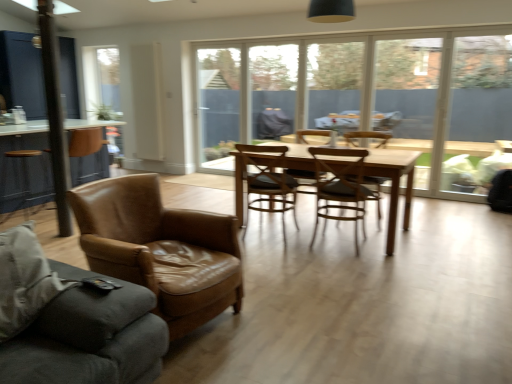
The height and width of the screenshot is (384, 512). Identify the location of brown leather armchair at left, the 1th chair in the front-to-back sequence. (161, 248).

The image size is (512, 384). I want to click on wooden chair at center, placed as the 1th chair when sorted from back to front, so click(315, 135).

The width and height of the screenshot is (512, 384). What do you see at coordinates (366, 137) in the screenshot?
I see `wooden chair at center, which ranks as the 4th chair in front-to-back order` at bounding box center [366, 137].

Describe the element at coordinates (273, 89) in the screenshot. This screenshot has width=512, height=384. I see `transparent glass window at center, which is counted as the second window, starting from the right` at that location.

Locate an element on the screen. light brown wooden table at center is located at coordinates (394, 184).

From the image's perspective, count 2nd chairs downward from the white matte radiator at upper center and point to it. Please provide its 2D coordinates.

[(366, 137)]

Can you confirm if white matte radiator at upper center is smaller than wooden chair at center, the 2th chair from the back?

Yes, white matte radiator at upper center is smaller than wooden chair at center, the 2th chair from the back.

Considering their positions, is white matte radiator at upper center located in front of or behind wooden chair at center, which ranks as the 4th chair in front-to-back order?

Visually, white matte radiator at upper center is located behind wooden chair at center, which ranks as the 4th chair in front-to-back order.

From the image's perspective, is white matte radiator at upper center under wooden chair at center, which ranks as the 4th chair in front-to-back order?

No.

Would you say transparent glass table at center, arranged as the second window when viewed from the left, is inside or outside wooden chair at center, which ranks as the 4th chair in front-to-back order?

transparent glass table at center, arranged as the second window when viewed from the left, is spatially situated outside wooden chair at center, which ranks as the 4th chair in front-to-back order.

From a real-world perspective, which object rests below the other?

wooden chair at center, the 2th chair from the back, from a real-world perspective.

Does point (333, 73) come in front of point (346, 134)?

No.

Can you tell me how much transparent glass table at center, arranged as the second window when viewed from the left, and wooden chair at center, which ranks as the 4th chair in front-to-back order, differ in facing direction?

There is a 2.73-degree angle between the facing directions of transparent glass table at center, arranged as the second window when viewed from the left, and wooden chair at center, which ranks as the 4th chair in front-to-back order.

Can you confirm if brown leather chair at center, which is the 3th chair from front to back, is wider than transparent glass table at center, the 1th window positioned from the right?

Correct, the width of brown leather chair at center, which is the 3th chair from front to back, exceeds that of transparent glass table at center, the 1th window positioned from the right.

You are a GUI agent. You are given a task and a screenshot of the screen. Output one action in this format:
    pyautogui.click(x=<x>, y=<y>)
    Task: Click on the 3rd chair positioned below the transparent glass table at center, the 1th window positioned from the right (from the image's perspective)
    This screenshot has height=384, width=512.
    Given the screenshot: What is the action you would take?
    pyautogui.click(x=268, y=178)

Consider the image. Is brown leather chair at center, the 3th chair from the back, at the right side of transparent glass table at center, arranged as the second window when viewed from the left?

In fact, brown leather chair at center, the 3th chair from the back, is to the left of transparent glass table at center, arranged as the second window when viewed from the left.

From a real-world perspective, which object stands above the other?

transparent glass table at center, the 1th window positioned from the right, is physically above.

Which is in front, point (213, 105) or point (17, 371)?

The point (17, 371) is closer to the camera.

Considering the sizes of objects transparent glass door at center and leather couch at left in the image provided, who is wider, transparent glass door at center or leather couch at left?

Wider between the two is leather couch at left.

From the image's perspective, would you say transparent glass door at center is positioned over leather couch at left?

Correct, transparent glass door at center appears higher than leather couch at left in the image.

Locate an element on the screen. window screen that appears above the leather couch at left (from a real-world perspective) is located at coordinates (218, 104).

Is transparent glass window at center, the first window from the left, smaller than transparent glass door at center?

Indeed, transparent glass window at center, the first window from the left, has a smaller size compared to transparent glass door at center.

Is the surface of transparent glass window at center, the first window from the left, in direct contact with transparent glass door at center?

No.

Where is `window screen located underneath the transparent glass window at center, which is counted as the second window, starting from the right (from a real-world perspective)`? window screen located underneath the transparent glass window at center, which is counted as the second window, starting from the right (from a real-world perspective) is located at coordinates (218, 104).

Is transparent glass window at center, the first window from the left, to the left of transparent glass door at center from the viewer's perspective?

No.

Who is shorter, transparent glass door at center or wooden chair at center, the second chair when ordered from front to back?

With less height is wooden chair at center, the second chair when ordered from front to back.

Which is correct: transparent glass door at center is inside wooden chair at center, the fourth chair in the back-to-front sequence, or outside of it?

transparent glass door at center is not enclosed by wooden chair at center, the fourth chair in the back-to-front sequence.

Which object is positioned more to the right, transparent glass door at center or wooden chair at center, the fourth chair in the back-to-front sequence?

wooden chair at center, the fourth chair in the back-to-front sequence, is more to the right.

Is transparent glass door at center touching brown leather armchair at left, the 5th chair viewed from the back?

No, transparent glass door at center is not beside brown leather armchair at left, the 5th chair viewed from the back.

Is transparent glass door at center completely or partially outside of brown leather armchair at left, the 1th chair in the front-to-back sequence?

transparent glass door at center lies outside brown leather armchair at left, the 1th chair in the front-to-back sequence,'s area.

Considering the relative sizes of transparent glass door at center and brown leather armchair at left, the 1th chair in the front-to-back sequence, in the image provided, is transparent glass door at center bigger than brown leather armchair at left, the 1th chair in the front-to-back sequence,?

No, transparent glass door at center is not bigger than brown leather armchair at left, the 1th chair in the front-to-back sequence.

Is transparent glass door at center taller or shorter than brown leather armchair at left, the 5th chair viewed from the back?

Considering their sizes, transparent glass door at center has more height than brown leather armchair at left, the 5th chair viewed from the back.

You are a GUI agent. You are given a task and a screenshot of the screen. Output one action in this format:
    pyautogui.click(x=<x>, y=<y>)
    Task: Click on the 1st chair located beneath the white matte radiator at upper center (from a real-world perspective)
    Image resolution: width=512 pixels, height=384 pixels.
    Given the screenshot: What is the action you would take?
    pyautogui.click(x=366, y=137)

From the image's perspective, count 2nd chairs downward from the transparent glass table at center, the 1th window positioned from the right, and point to it. Please provide its 2D coordinates.

[(366, 137)]

Based on their spatial positions, is brown leather chair at center, the 3th chair from the back, or wooden chair at center, which ranks as the 4th chair in front-to-back order, further from wooden chair at center, which is the 5th chair from front to back?

brown leather chair at center, the 3th chair from the back, lies further to wooden chair at center, which is the 5th chair from front to back, than the other object.

Based on the photo, considering their positions, is wooden chair at center, placed as the 1th chair when sorted from back to front, positioned further to transparent glass door at center than transparent glass table at center, the 1th window positioned from the right?

Among the two, wooden chair at center, placed as the 1th chair when sorted from back to front, is located further to transparent glass door at center.

In the scene shown: From the image, which object appears to be nearer to transparent glass window at center, which is counted as the second window, starting from the right, light brown wooden table at center or leather couch at left?

light brown wooden table at center is positioned closer to the anchor transparent glass window at center, which is counted as the second window, starting from the right.

When comparing their distances from leather couch at left, does brown leather armchair at left, the 5th chair viewed from the back, or transparent glass window at center, which is counted as the second window, starting from the right, seem closer?

brown leather armchair at left, the 5th chair viewed from the back, is closer to leather couch at left.

Considering their positions, is leather couch at left positioned closer to wooden chair at center, which ranks as the 4th chair in front-to-back order, than brown leather table at left?

leather couch at left is closer to wooden chair at center, which ranks as the 4th chair in front-to-back order.

Estimate the real-world distances between objects in this image. Which object is further from transparent glass table at center, arranged as the second window when viewed from the left, transparent glass door at center or wooden chair at center, which ranks as the 4th chair in front-to-back order?

wooden chair at center, which ranks as the 4th chair in front-to-back order.

Looking at the image, which one is located closer to transparent glass door at center, white matte radiator at upper center or transparent glass window at center, which is counted as the second window, starting from the right?

transparent glass window at center, which is counted as the second window, starting from the right.

From the image, which object appears to be nearer to wooden chair at center, which ranks as the 4th chair in front-to-back order, brown leather table at left or transparent glass door at center?

transparent glass door at center.

Locate an element on the screen. The image size is (512, 384). chair positioned between wooden chair at center, which ranks as the 4th chair in front-to-back order, and transparent glass table at center, arranged as the second window when viewed from the left, from near to far is located at coordinates (315, 135).

Where is `kitchen & dining room table between brown leather armchair at left, the 1th chair in the front-to-back sequence, and wooden chair at center, placed as the 1th chair when sorted from back to front, along the z-axis`? The image size is (512, 384). kitchen & dining room table between brown leather armchair at left, the 1th chair in the front-to-back sequence, and wooden chair at center, placed as the 1th chair when sorted from back to front, along the z-axis is located at coordinates (394, 184).

The image size is (512, 384). What are the coordinates of `screen door situated between brown leather table at left and wooden chair at center, which is the 5th chair from front to back, from left to right` in the screenshot? It's located at (147, 100).

Find the location of a particular element. window screen between brown leather table at left and wooden chair at center, the second chair when ordered from front to back is located at coordinates (218, 104).